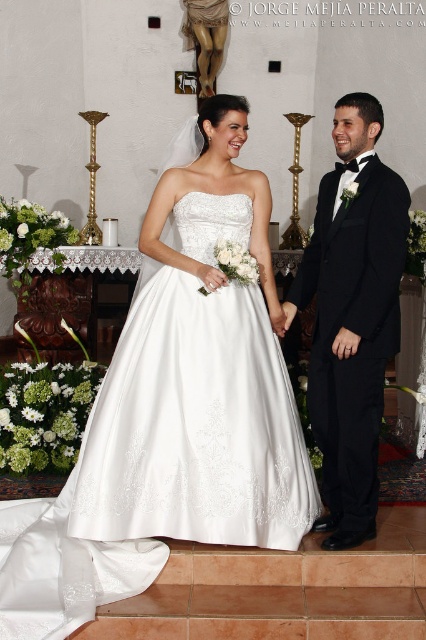
Is white satin dress at center wider than black satin tuxedo at right?

Correct, the width of white satin dress at center exceeds that of black satin tuxedo at right.

Who is shorter, white satin dress at center or black satin tuxedo at right?

black satin tuxedo at right is shorter.

Between point (298, 524) and point (339, 332), which one is positioned behind?

The point (298, 524) is behind.

Identify the location of white satin dress at center. (198, 372).